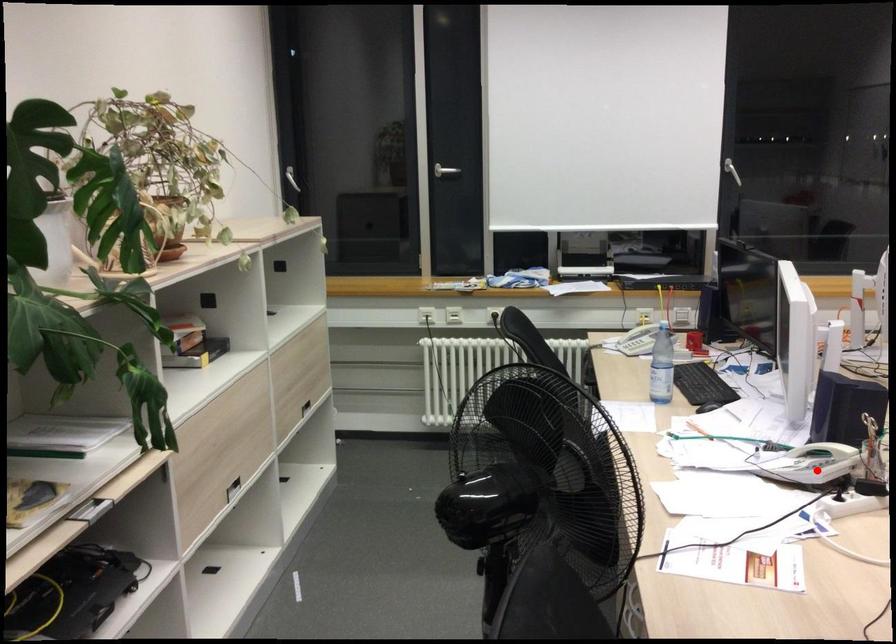
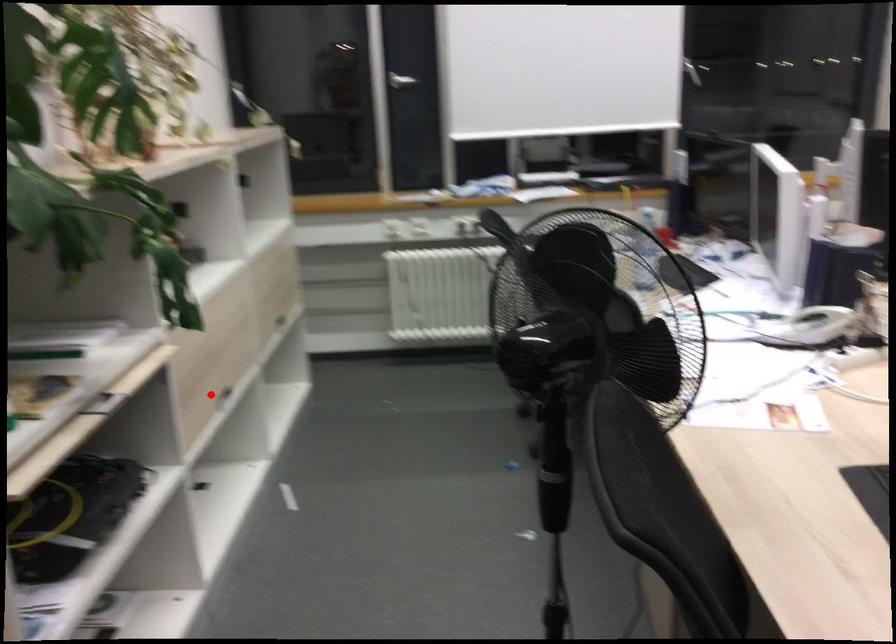
I am providing you with two images of the same scene from different viewpoints. A red point is marked on the first image and another point is marked on the second image. Do the highlighted points in image1 and image2 indicate the same real-world spot?

No